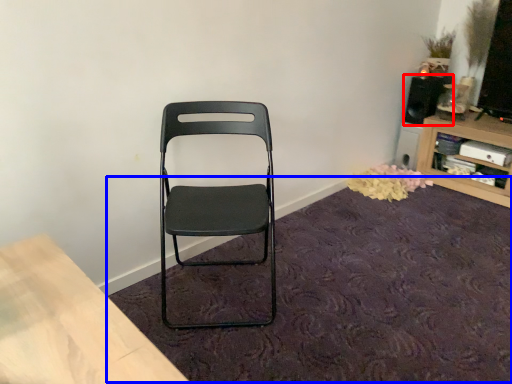
Question: Which point is closer to the camera, speaker (highlighted by a red box) or mat (highlighted by a blue box)?

Choices:
 (A) speaker
 (B) mat

Answer: (B)